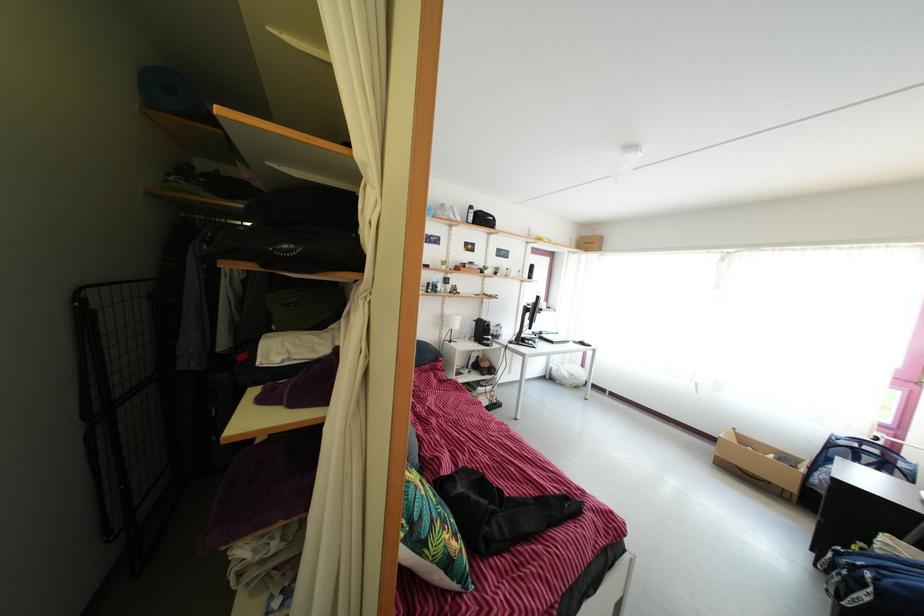
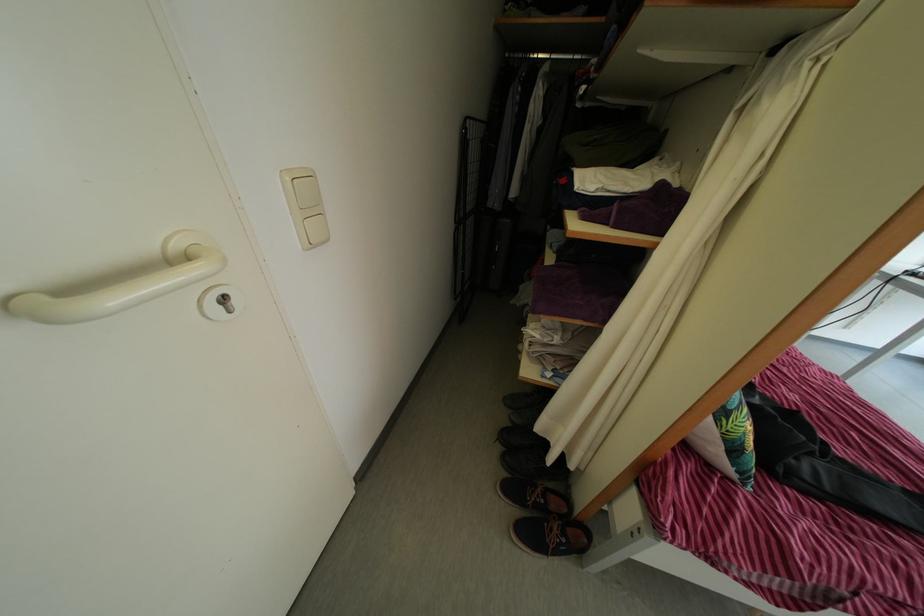
Locate, in the second image, the point that corresponds to point 444,572 in the first image.

(732, 448)